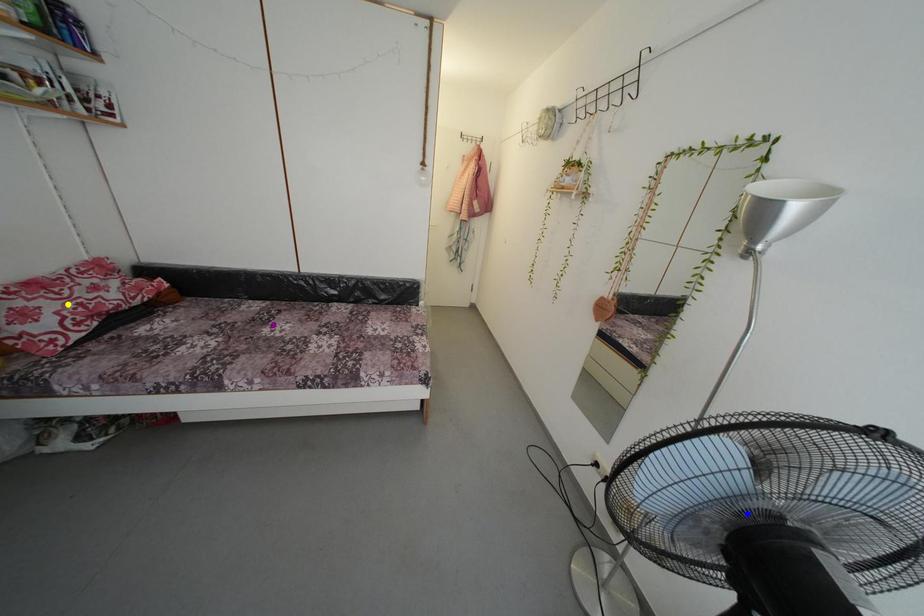
Order these from nearest to farthest:
A) blue point
B) purple point
C) yellow point

1. blue point
2. yellow point
3. purple point